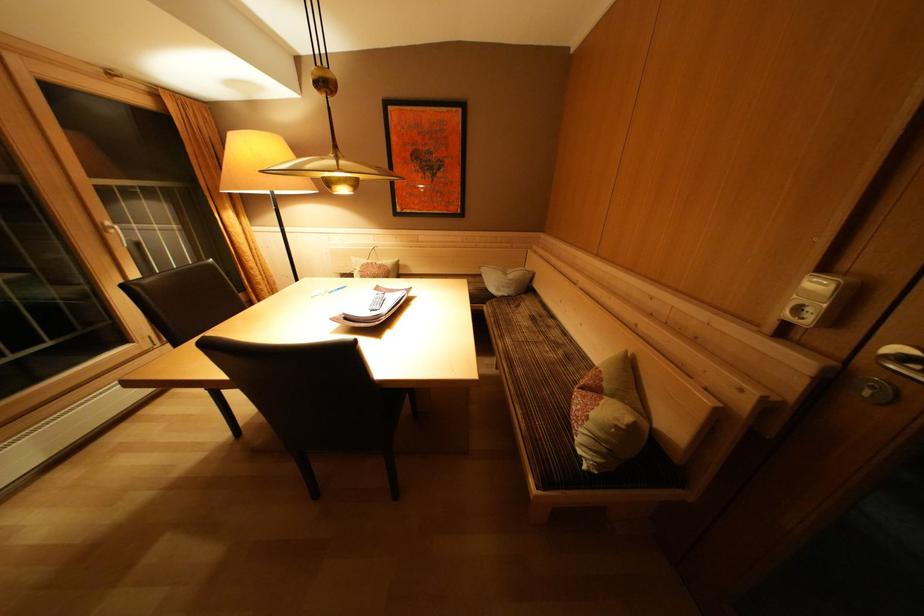
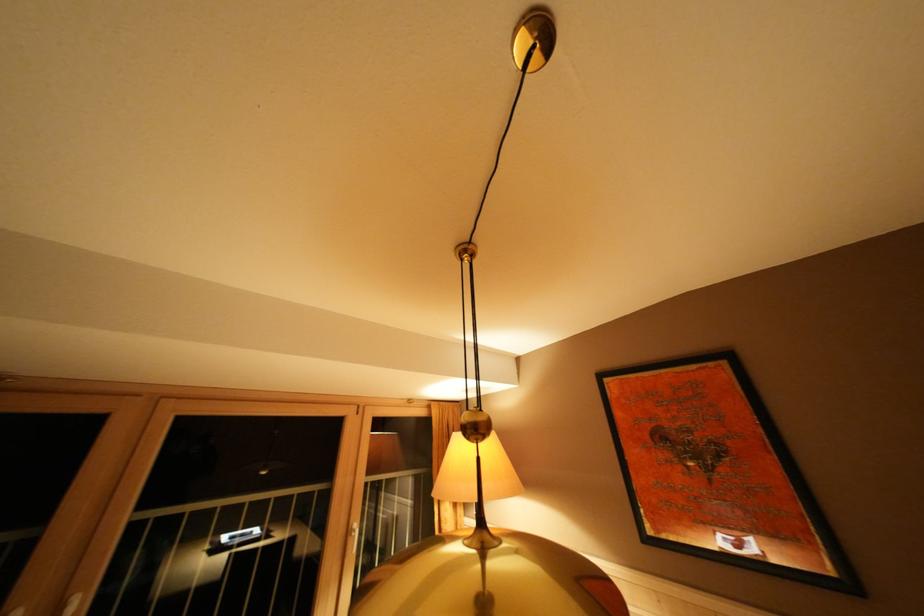
Consider the image. First-person continuous shooting, in which direction is the camera rotating?

The rotation direction of the camera is left-up.